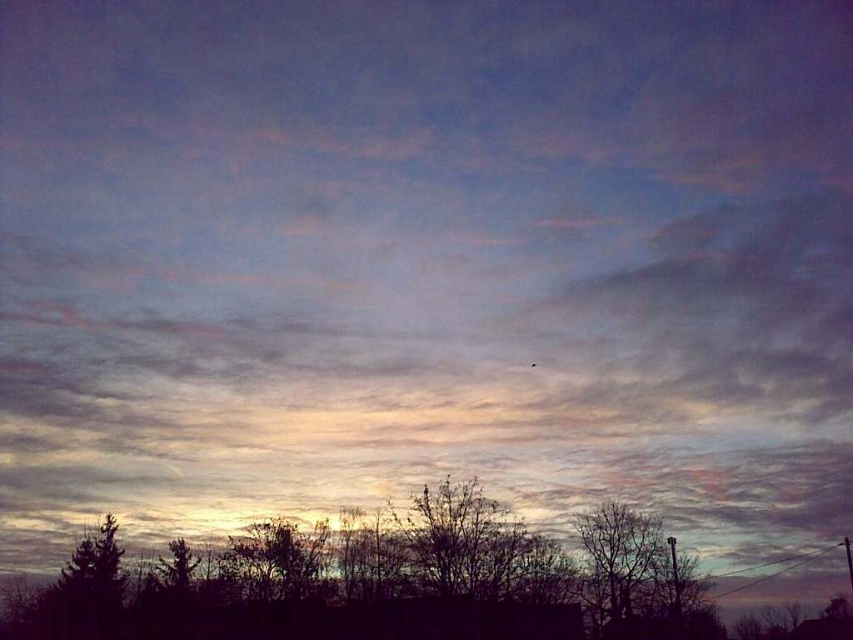
The height and width of the screenshot is (640, 853). What do you see at coordinates (357, 586) in the screenshot?
I see `silhouette leafless tree at lower center` at bounding box center [357, 586].

Is silhouette leafless tree at lower center bigger than dark brown bark tree at lower right?

Yes, silhouette leafless tree at lower center is bigger than dark brown bark tree at lower right.

Who is more forward, (477,609) or (625,570)?

Point (625,570)

Identify the location of silhouette leafless tree at lower center. (357, 586).